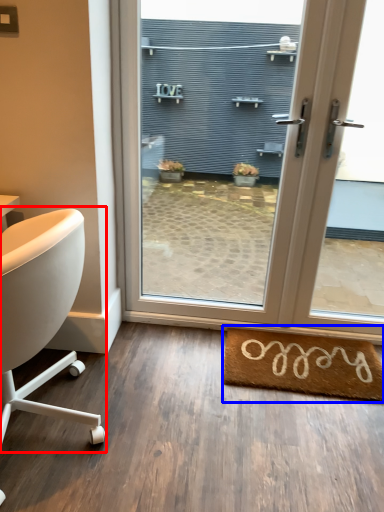
Question: Which object is further to the camera taking this photo, chair (highlighted by a red box) or mat (highlighted by a blue box)?

Choices:
 (A) chair
 (B) mat

Answer: (B)